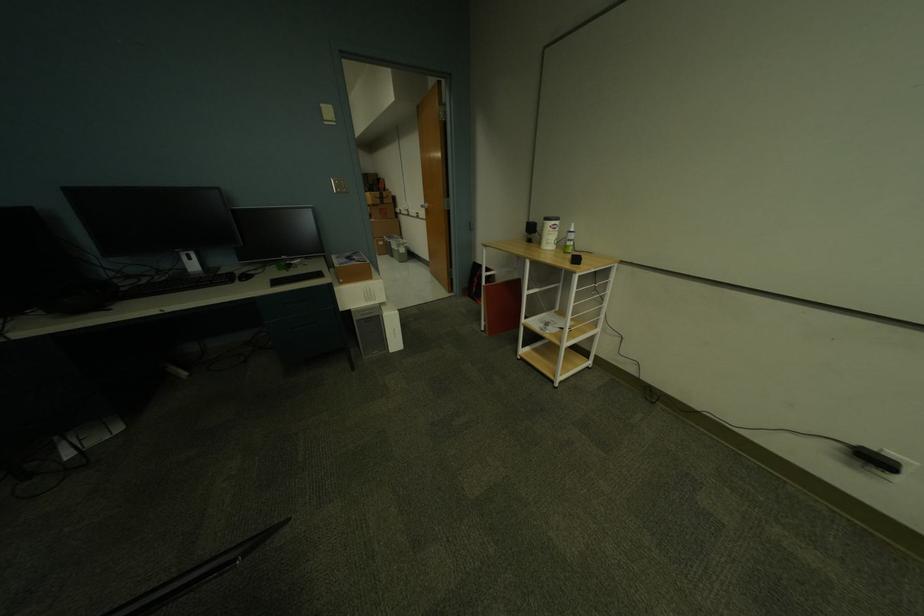
This screenshot has height=616, width=924. Describe the element at coordinates (569, 240) in the screenshot. I see `a spray bottle nozzle` at that location.